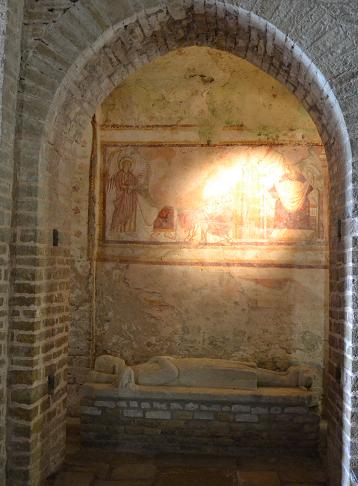
You are a GUI agent. You are given a task and a screenshot of the screen. Output one action in this format:
    pyautogui.click(x=<x>, y=<y>)
    Task: Click on the walls
    The height and width of the screenshot is (486, 358).
    Given the screenshot: What is the action you would take?
    pyautogui.click(x=28, y=288), pyautogui.click(x=345, y=301)